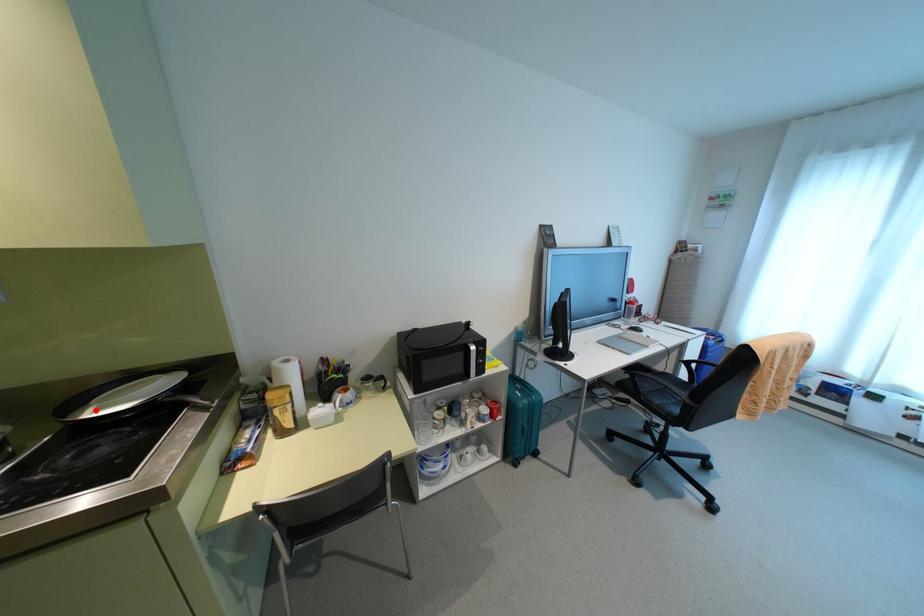
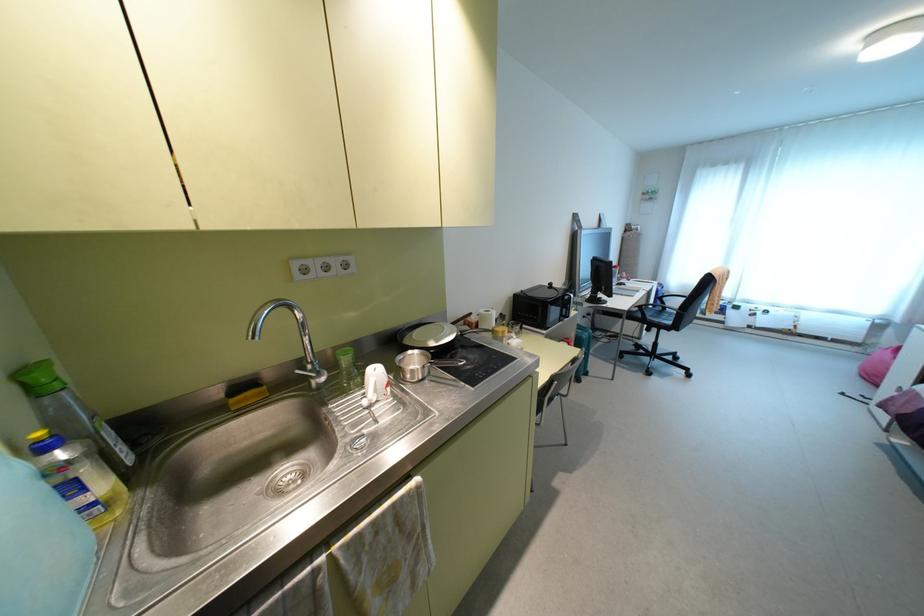
Where in the second image is the point corresponding to the highlighted location from the first image?

(435, 341)